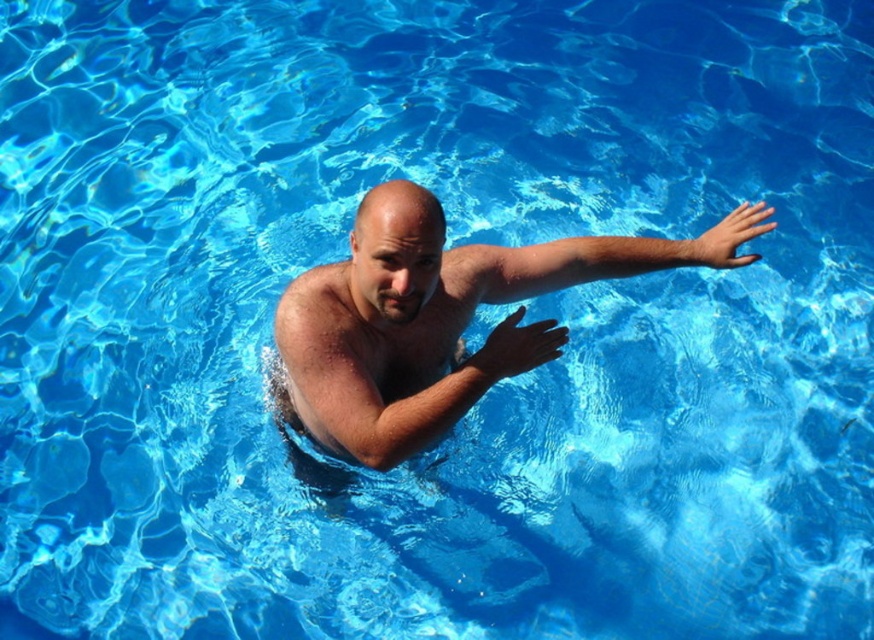
Who is more distant from viewer, (392, 292) or (584, 269)?

The point (584, 269) is more distant.

The image size is (874, 640). What are the coordinates of `smooth skin man at center` in the screenshot? It's located at (415, 321).

How distant is slick skin arm at upper right from matte blue hand at upper right?

The distance of slick skin arm at upper right from matte blue hand at upper right is 8.70 inches.

Which is below, slick skin arm at upper right or matte blue hand at upper right?

Positioned lower is slick skin arm at upper right.

Identify the location of slick skin arm at upper right. pos(612,257).

Is smooth skin man at center thinner than matte blue hand at upper right?

Incorrect, smooth skin man at center's width is not less than matte blue hand at upper right's.

Is the position of smooth skin man at center more distant than that of matte blue hand at upper right?

No.

Between point (386, 188) and point (708, 228), which one is positioned behind?

Point (708, 228)

Find the location of a particular element. The image size is (874, 640). smooth skin man at center is located at coordinates (415, 321).